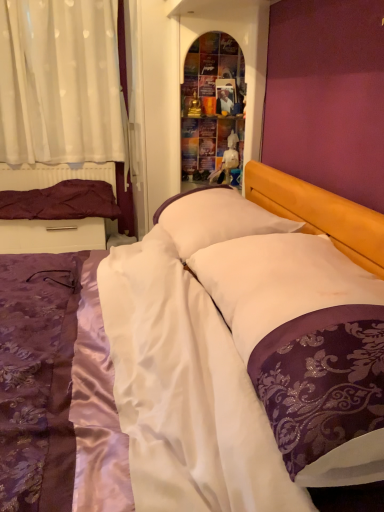
Question: From a real-world perspective, relative to purple satin pillow at left, positioned as the 1th pillow in back-to-front order, is white sheer curtain at upper left vertically above or below?

Choices:
 (A) below
 (B) above

Answer: (B)

Question: Would you say white sheer curtain at upper left is to the left or to the right of purple satin pillow at left, positioned as the 1th pillow in back-to-front order, in the picture?

Choices:
 (A) left
 (B) right

Answer: (B)

Question: Estimate the real-world distances between objects in this image. Which object is closer to the purple satin bed at center?

Choices:
 (A) white sheer curtain at upper left
 (B) white satin pillow at center, which appears as the third pillow when viewed from the left
 (C) purple satin pillow at left, which is counted as the 3th pillow, starting from the front
 (D) multicolored glass shelf at center
 (E) white soft pillow at center, arranged as the 2th pillow when viewed from the right

Answer: (B)

Question: Estimate the real-world distances between objects in this image. Which object is closer to the white soft pillow at center, acting as the 2th pillow starting from the front?

Choices:
 (A) multicolored glass shelf at center
 (B) white sheer curtain at upper left
 (C) purple satin bed at center
 (D) purple satin pillow at left, which appears as the third pillow when viewed from the right
 (E) white satin pillow at center, the 1th pillow in the right-to-left sequence

Answer: (E)